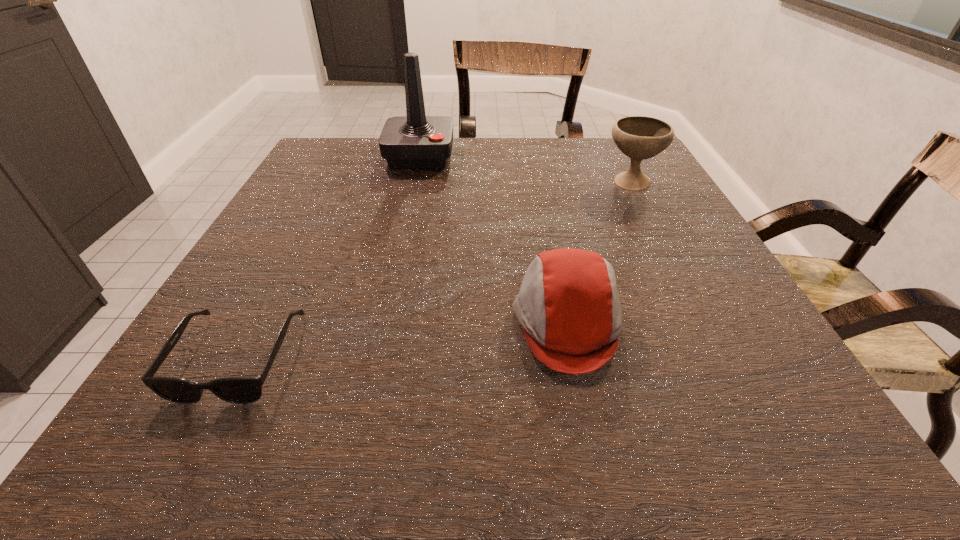
I want to click on vacant region located 0.340m on the front-facing side of the second shortest object, so click(303, 322).

Locate an element on the screen. vacant space located 0.320m on the front-facing side of the second shortest object is located at coordinates (316, 322).

Locate an element on the screen. vacant space located 0.060m on the front-facing side of the second shortest object is located at coordinates (476, 322).

At what (x,y) coordinates should I click in order to perform the action: click on free space located at the front lenses of the shortest object. Please return your answer as a coordinate pair (x, y). Looking at the image, I should click on (192, 446).

Where is `joystick that is at the far edge`? This screenshot has width=960, height=540. joystick that is at the far edge is located at coordinates (416, 141).

Image resolution: width=960 pixels, height=540 pixels. I want to click on chalice at the far edge, so click(638, 137).

Locate an element on the screen. object located in the near edge section of the desktop is located at coordinates (241, 390).

This screenshot has height=540, width=960. I want to click on object that is at the left edge, so click(241, 390).

Locate an element on the screen. Image resolution: width=960 pixels, height=540 pixels. object that is at the right edge is located at coordinates (638, 137).

Find the location of `object situated at the near left corner`. object situated at the near left corner is located at coordinates (241, 390).